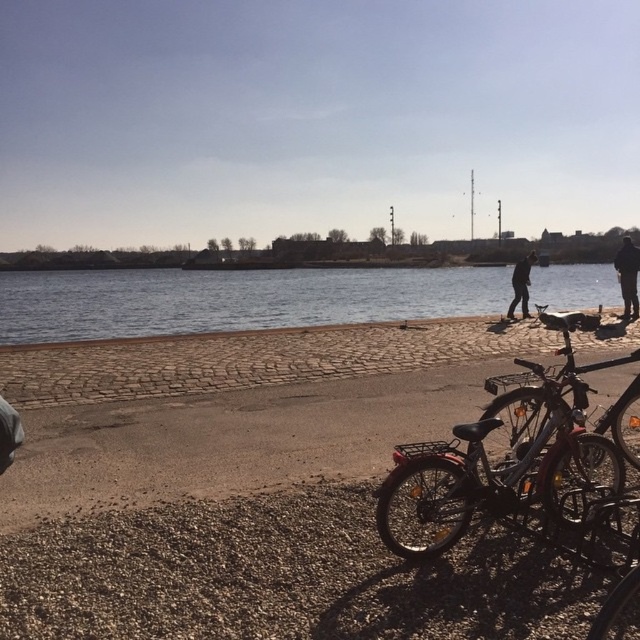
You are standing on the cobblestone walkway and want to take a photo of the blue water at center and the dark gray pants at right. Which object should you focus on first to ensure both are in clear view?

You should focus on the dark gray pants at right first because it is closer to you than the blue water at center, which is further away. This way, both objects will be in focus as the blue water at center is behind the dark gray pants at right.

You are a photographer standing at the riverside. You see the dark gray pants at right and the black fabric jacket at center. Which one appears taller in the photo?

The dark gray pants at right is taller than the black fabric jacket at center.